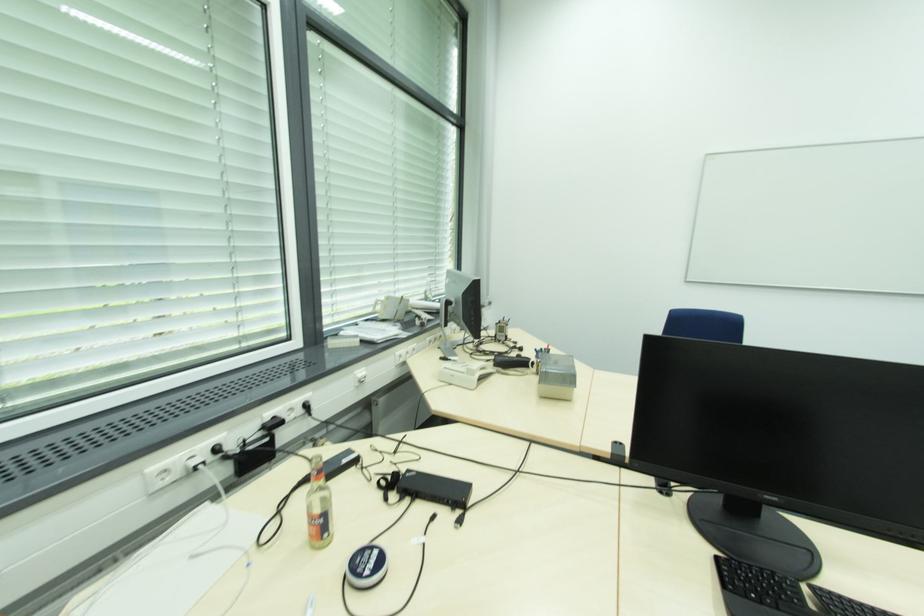
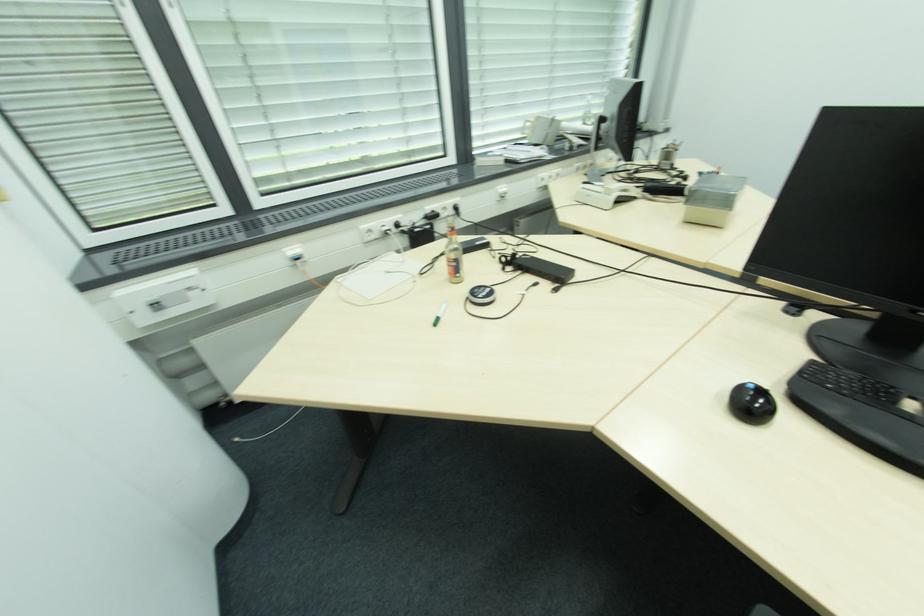
Locate, in the second image, the point that corresponds to pixel 574 381 in the first image.

(730, 203)